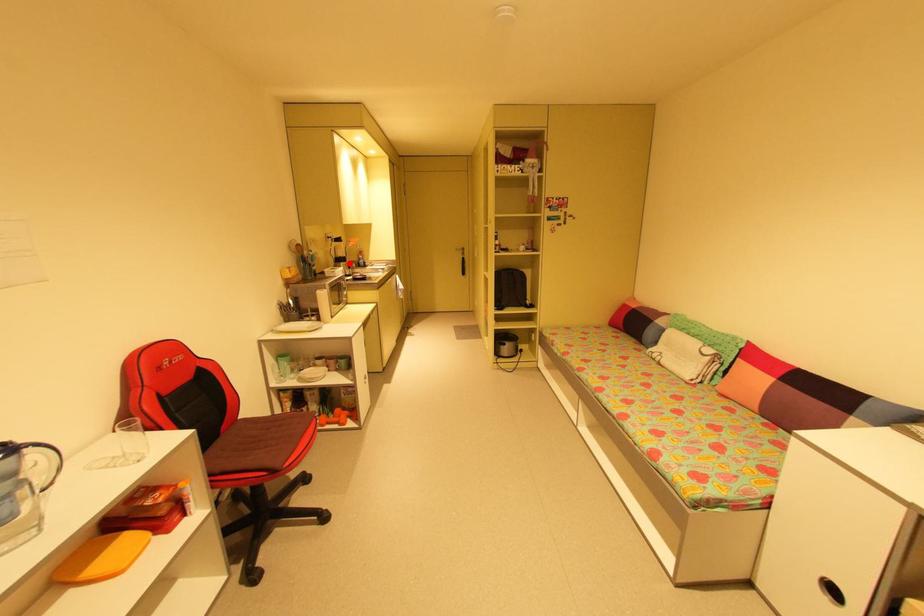
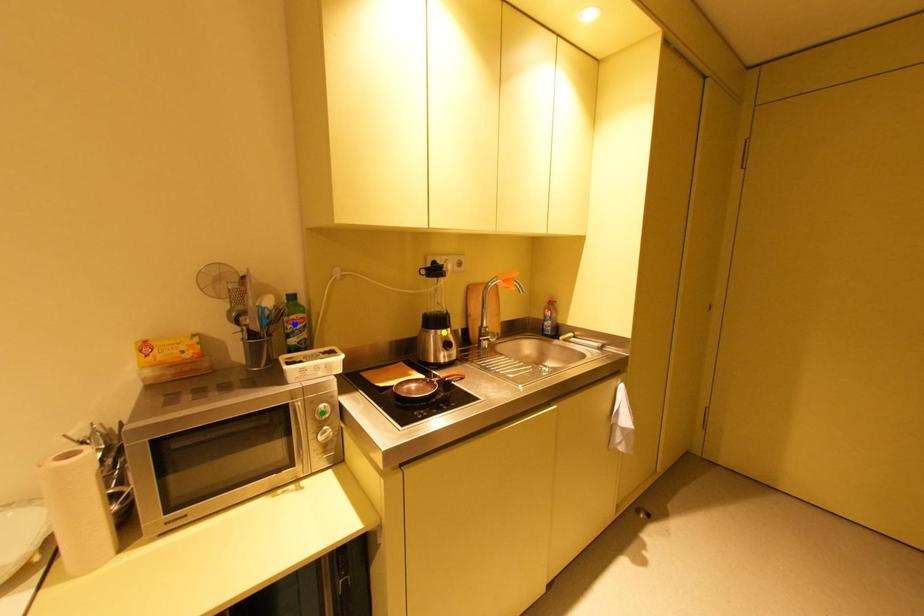
Question: I am providing you with two images of the same scene from different viewpoints. A red point is marked on the first image. You are given multiple points on the second image. In image 2, which mark is for the same physical point as the one in image 1?

Choices:
 (A) green point
 (B) yellow point
 (C) blue point

Answer: (B)